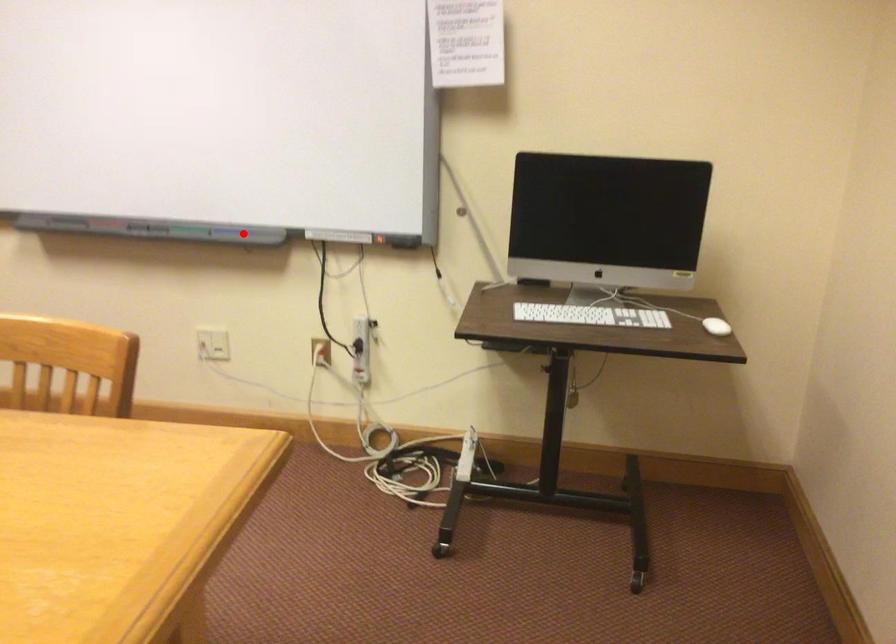
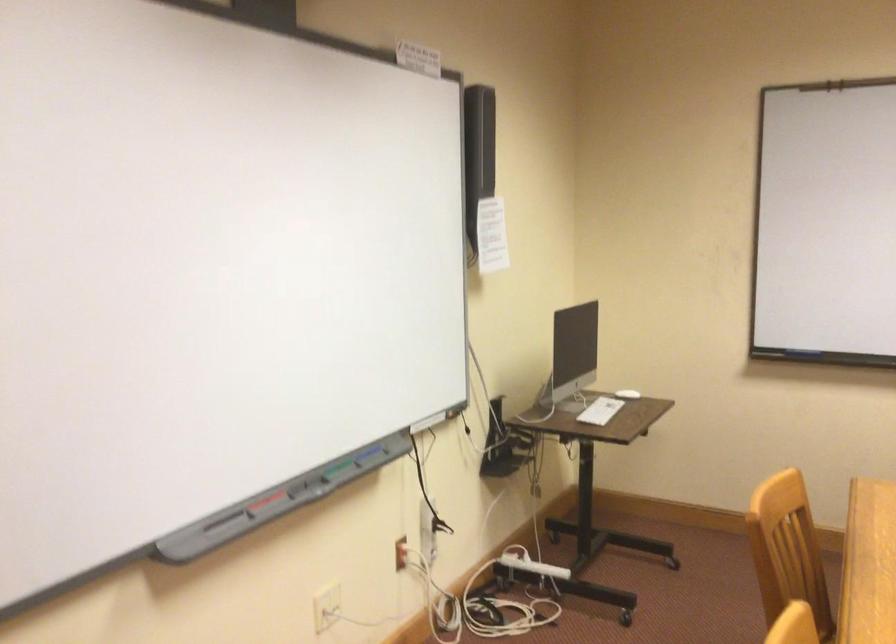
Question: I am providing you with two images of the same scene from different viewpoints. A red point is marked on the first image. At the location where the point appears in image 1, is it still visible in image 2?

Choices:
 (A) Yes
 (B) No

Answer: (A)